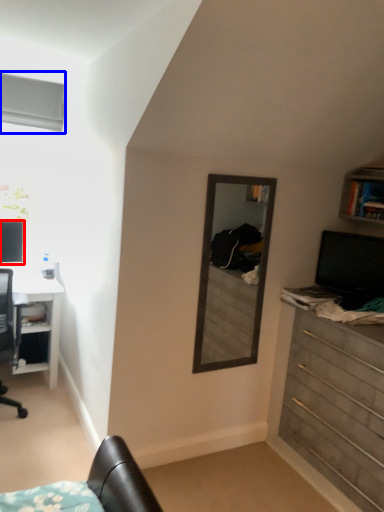
Question: Which of the following is the closest to the observer, computer monitor (highlighted by a red box) or window (highlighted by a blue box)?

Choices:
 (A) computer monitor
 (B) window

Answer: (B)